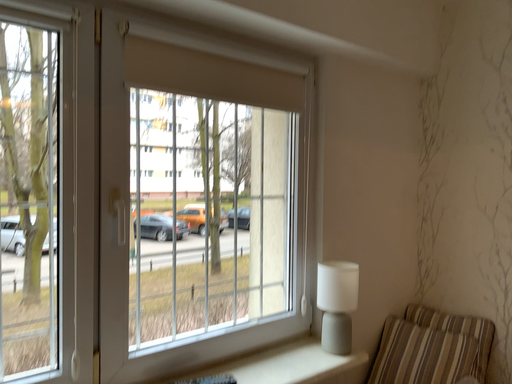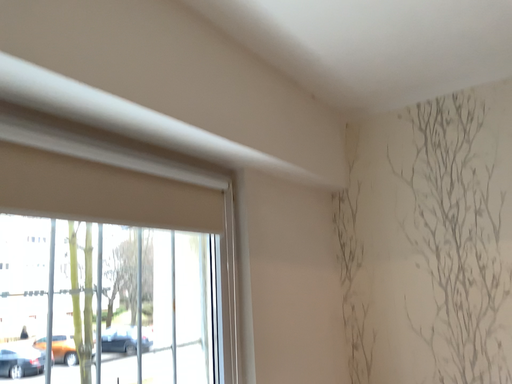
Question: How did the camera likely rotate when shooting the video?

Choices:
 (A) rotated upward
 (B) rotated downward

Answer: (A)